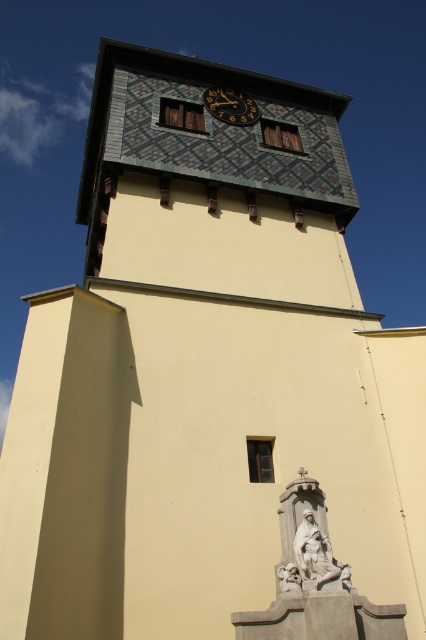
You are an architect visiting the building and want to place a new decorative element between the white marble statue at lower center and the gold metallic clock at upper center. Is there enough vertical space between them to place a 1.5 meter tall sculpture?

The white marble statue at lower center is located below the gold metallic clock at upper center, but the exact vertical distance between them is not specified. Without knowing the height difference, it is impossible to determine if the 1.5 meter tall sculpture will fit between them.

You are standing in front of the building and want to take a photo of the white marble statue at lower center and the gold metallic clock at upper center. Which object will appear larger in your photo?

The white marble statue at lower center will appear larger in the photo because it is closer to the viewer than the gold metallic clock at upper center.